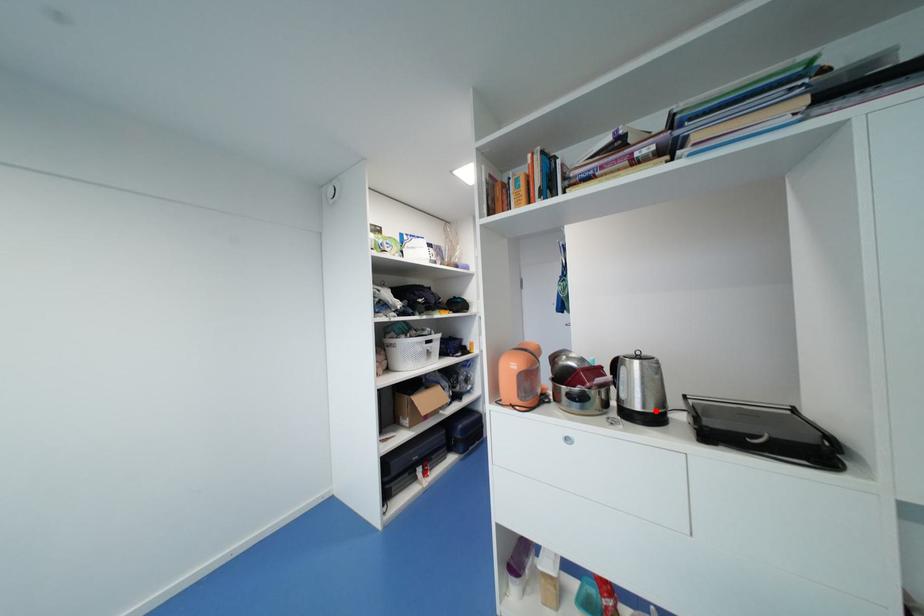
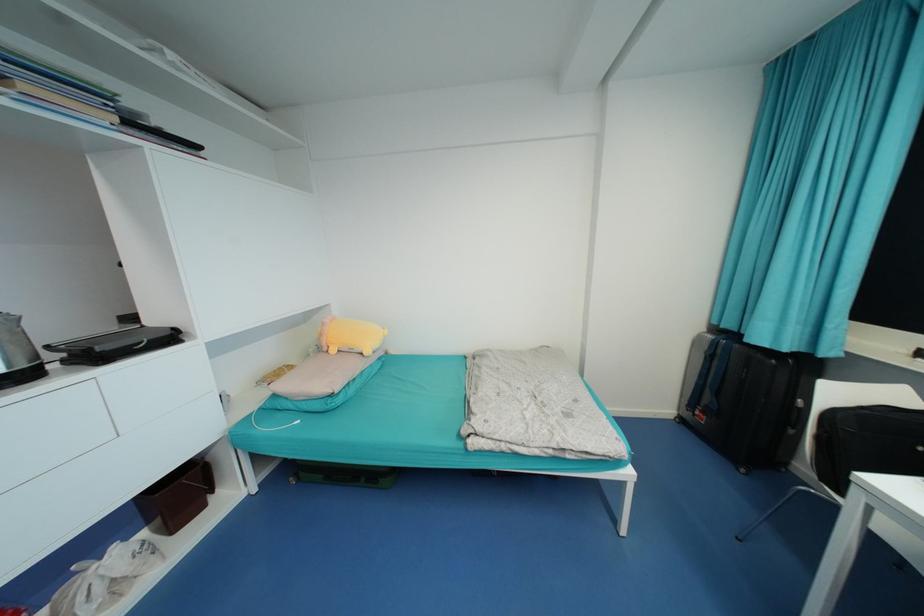
Locate, in the second image, the point that corresponds to the highlighted location in the first image.

(30, 367)